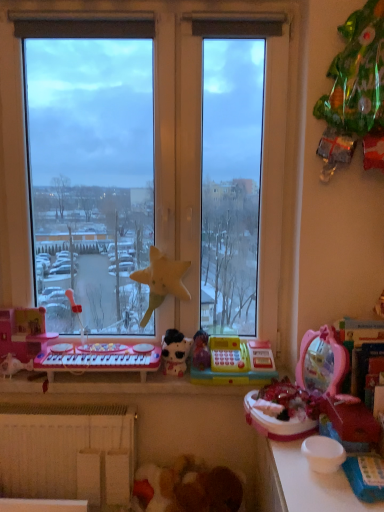
Locate an element on the screen. This screenshot has width=384, height=512. free space above transparent glass window at center (from a real-world perspective) is located at coordinates (154, 2).